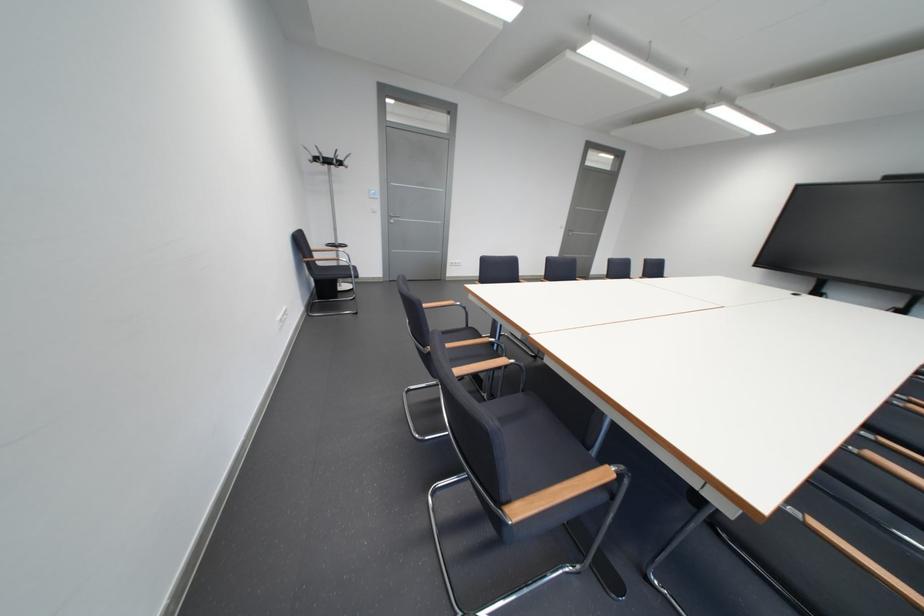
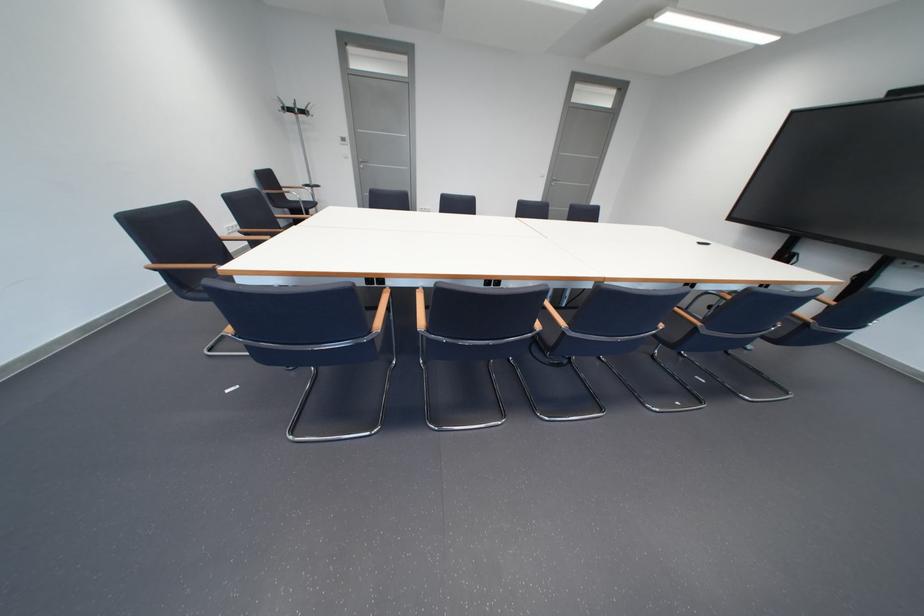
Question: In a continuous first-person perspective shot, in which direction is the camera moving?

Choices:
 (A) Left
 (B) Right
 (C) Forward
 (D) Backward

Answer: (B)